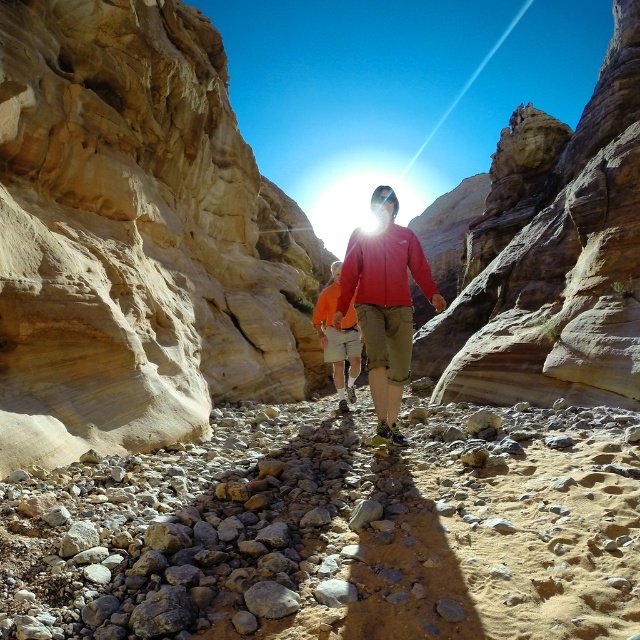
Is smooth sandstone rock at center wider than orange cotton shirt at center?

Indeed, smooth sandstone rock at center has a greater width compared to orange cotton shirt at center.

Between point (488, 397) and point (330, 326), which one is positioned behind?

The point (330, 326) is more distant.

Who is more forward, (611, 148) or (337, 356)?

Positioned in front is point (611, 148).

Locate an element on the screen. This screenshot has width=640, height=640. smooth sandstone rock at center is located at coordinates (552, 256).

Can you confirm if smooth beige rock at center is positioned to the left of matte red jacket at center?

Indeed, smooth beige rock at center is positioned on the left side of matte red jacket at center.

Is point (32, 276) behind point (384, 237)?

No, it is not.

The image size is (640, 640). I want to click on smooth beige rock at center, so click(136, 236).

Is matte red jacket at center shorter than orange cotton shirt at center?

Yes.

Image resolution: width=640 pixels, height=640 pixels. What do you see at coordinates (385, 304) in the screenshot?
I see `matte red jacket at center` at bounding box center [385, 304].

Locate an element on the screen. The height and width of the screenshot is (640, 640). matte red jacket at center is located at coordinates (385, 304).